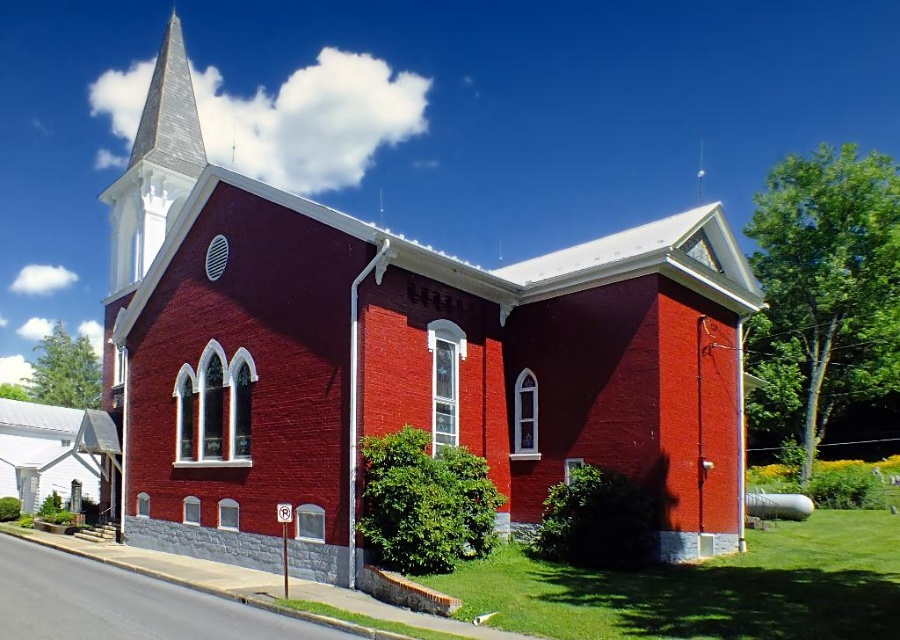
Does point (645, 480) come closer to viewer compared to point (168, 176)?

Yes, it is.

Can you confirm if brick church at center is positioned below white steeple at upper left?

Indeed, brick church at center is positioned under white steeple at upper left.

The height and width of the screenshot is (640, 900). What do you see at coordinates (397, 358) in the screenshot?
I see `brick church at center` at bounding box center [397, 358].

Locate an element on the screen. The image size is (900, 640). brick church at center is located at coordinates (397, 358).